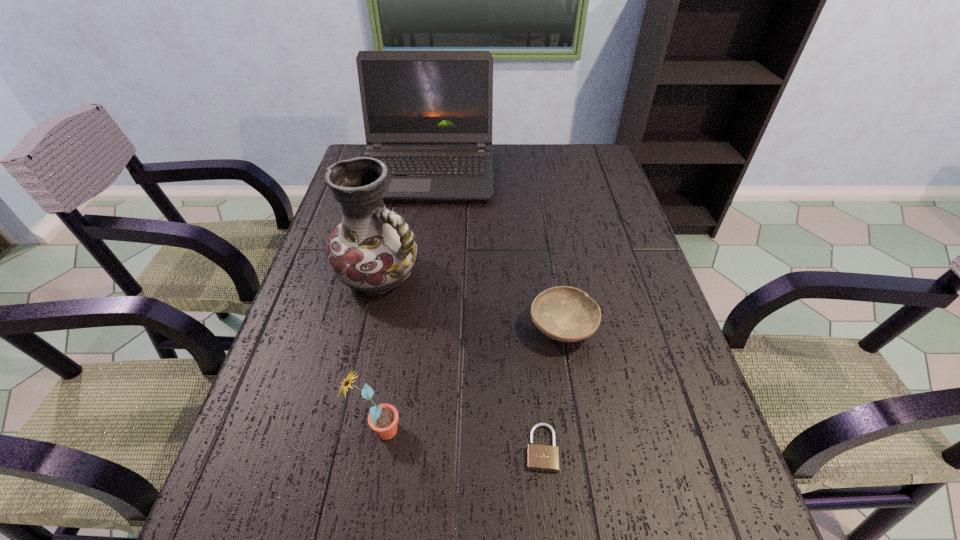
At what (x,y) coordinates should I click in order to perform the action: click on free space that is in between the padlock and the bowl. Please return your answer as a coordinate pair (x, y). Image resolution: width=960 pixels, height=540 pixels. Looking at the image, I should click on (552, 387).

This screenshot has width=960, height=540. What are the coordinates of `free point between the padlock and the second shortest object` in the screenshot? It's located at (552, 387).

Find the location of a particular element. This screenshot has height=540, width=960. free space between the shortest object and the vase is located at coordinates coord(461,361).

Where is `free space that is in between the padlock and the bowl`? free space that is in between the padlock and the bowl is located at coordinates pos(552,387).

Identify the location of vacant area between the third shortest object and the farthest object. The image size is (960, 540). (403, 301).

Identify the location of free spot between the third tallest object and the laptop_computer. (403, 301).

Locate an element on the screen. free space between the vase and the padlock is located at coordinates (461, 361).

The height and width of the screenshot is (540, 960). I want to click on empty space between the padlock and the third tallest object, so click(460, 439).

Identify which object is located as the fourth nearest to the shortest object. Please provide its 2D coordinates. Your answer should be formatted as a tuple, i.e. [(x, y)], where the tuple contains the x and y coordinates of a point satisfying the conditions above.

[(427, 115)]

Locate an element on the screen. object that stands as the third closest to the vase is located at coordinates (383, 419).